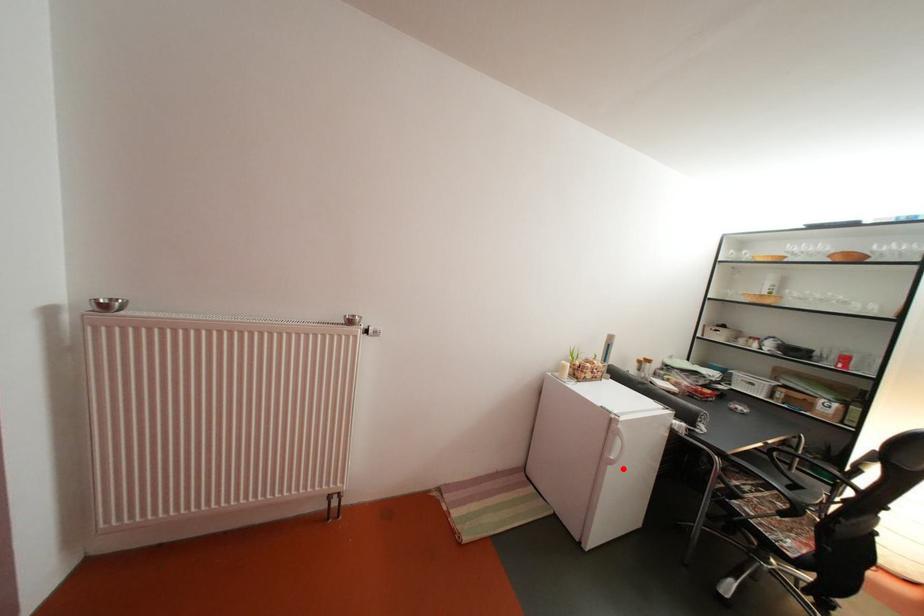
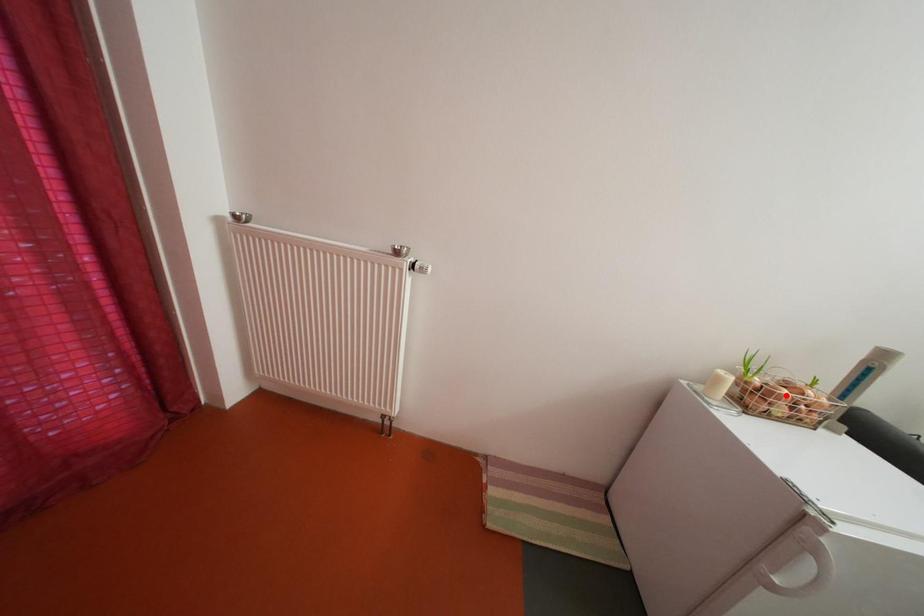
I am providing you with two images of the same scene from different viewpoints. A red point is marked on the first image and another point is marked on the second image. Is the marked point in image1 the same physical position as the marked point in image2?

No